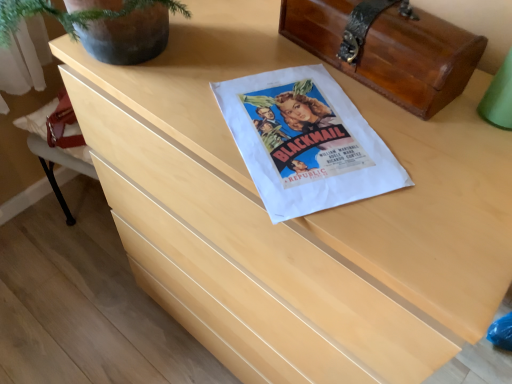
Identify the location of free space to the left of shiny brown wood chest at upper right. (243, 58).